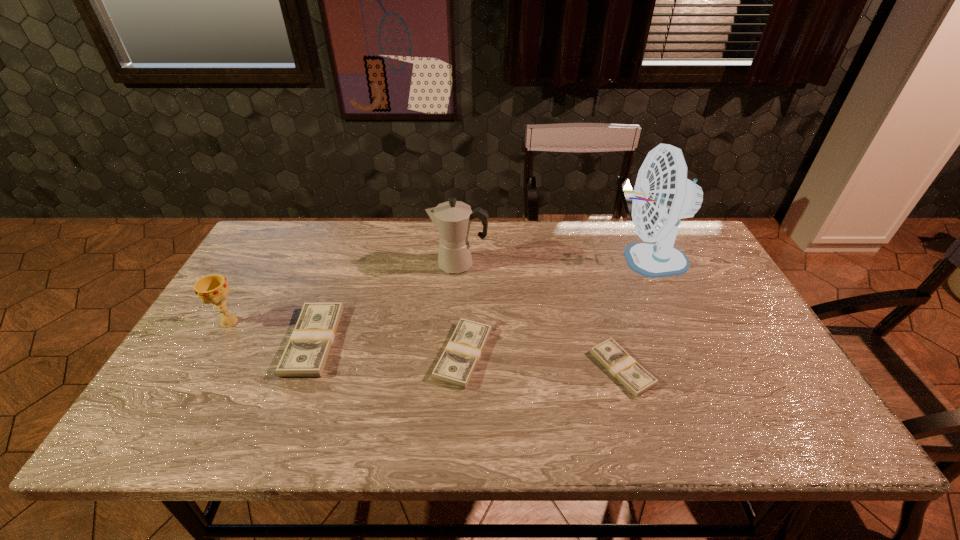
Locate which dollar is the second closest to the coffeepot. Please provide its 2D coordinates. Your answer should be formatted as a tuple, i.e. [(x, y)], where the tuple contains the x and y coordinates of a point satisfying the conditions above.

[(306, 354)]

Where is `vacant point that satisfies the following two spatial constraints: 1. on the front side of the shortest dollar; 2. on the right side of the leftmost dollar`? vacant point that satisfies the following two spatial constraints: 1. on the front side of the shortest dollar; 2. on the right side of the leftmost dollar is located at coordinates (303, 368).